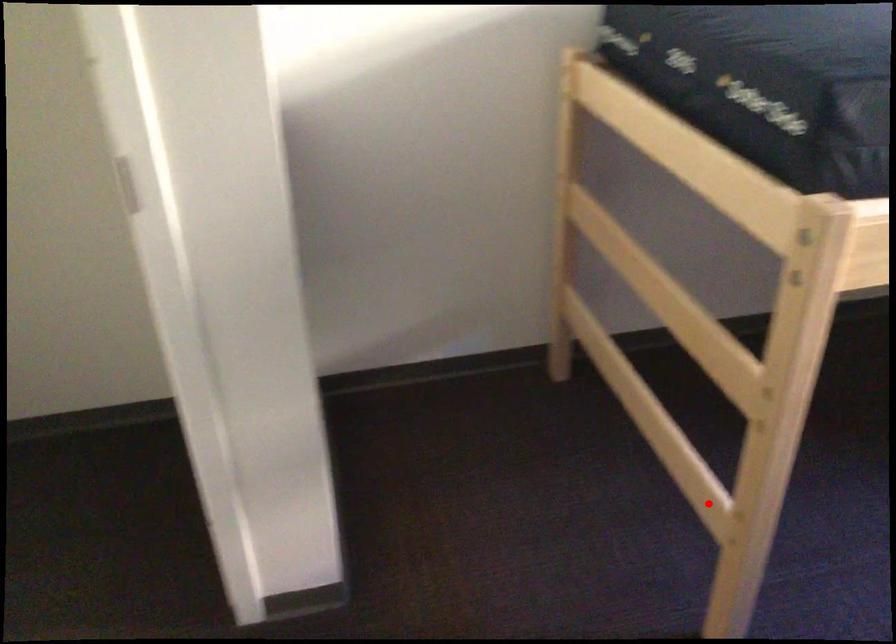
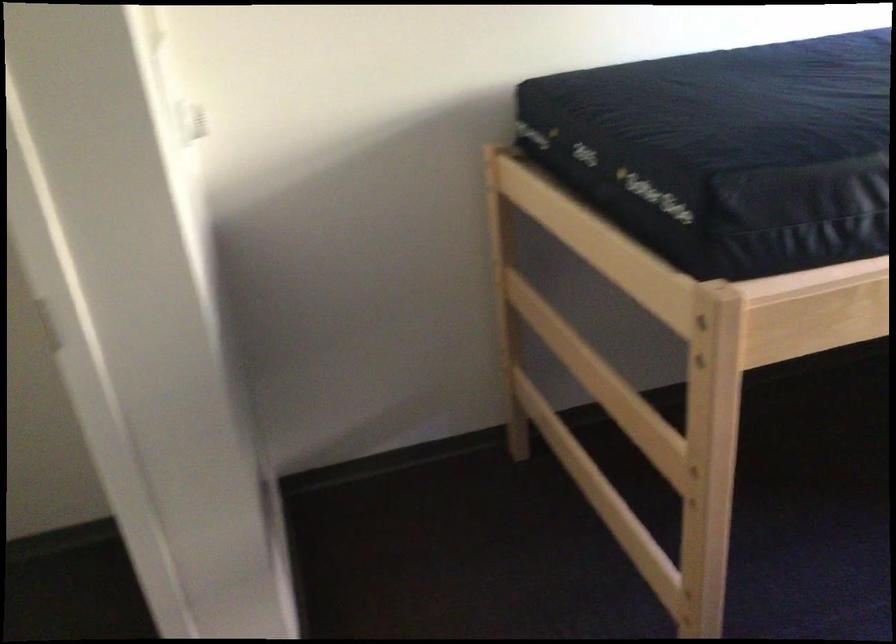
Where in the second image is the point corresponding to the highlighted location from the first image?

(661, 582)